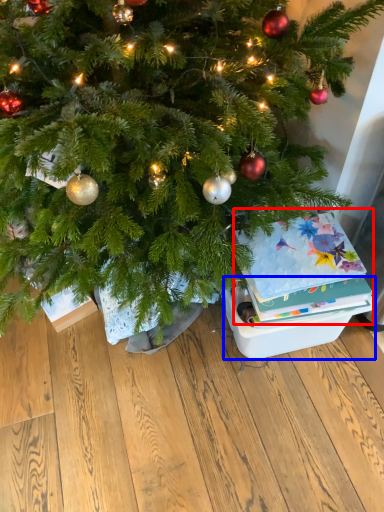
Question: Which object is closer to the camera taking this photo, christmas card (highlighted by a red box) or storage box (highlighted by a blue box)?

Choices:
 (A) christmas card
 (B) storage box

Answer: (A)